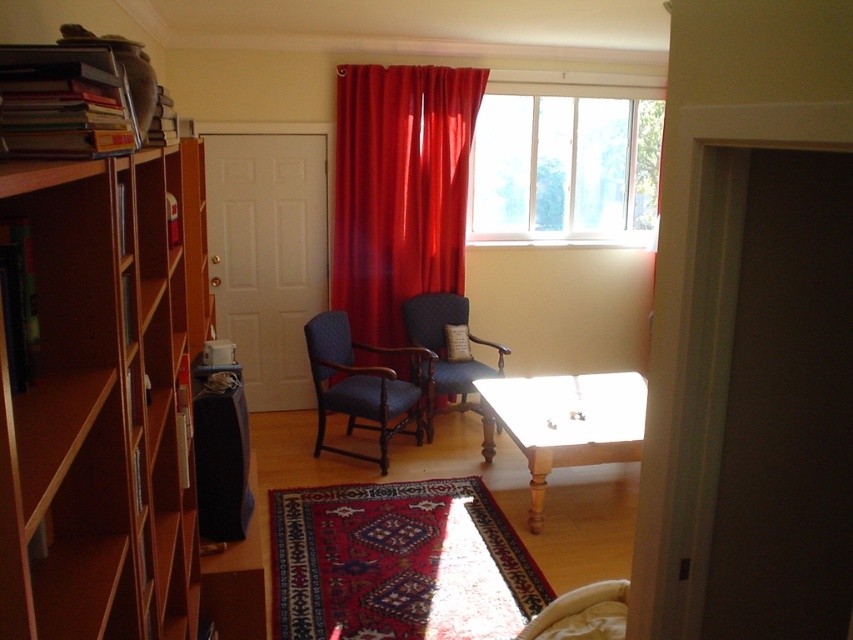
Which is more to the right, light wood table at center or dark blue quilted armchair at center?

Positioned to the right is light wood table at center.

Who is more distant from viewer, (x=634, y=448) or (x=457, y=317)?

The point (x=457, y=317) is behind.

Does point (543, 412) lie behind point (434, 339)?

That is False.

Where is `light wood table at center`? The height and width of the screenshot is (640, 853). light wood table at center is located at coordinates (564, 422).

Between brown wooden bookcase at left and dark blue quilted armchair at center, which one appears on the right side from the viewer's perspective?

From the viewer's perspective, dark blue quilted armchair at center appears more on the right side.

Describe the element at coordinates (103, 401) in the screenshot. The image size is (853, 640). I see `brown wooden bookcase at left` at that location.

Find the location of a particular element. This screenshot has height=640, width=853. brown wooden bookcase at left is located at coordinates (103, 401).

Does brown wooden bookcase at left lie in front of transparent glass window at upper center?

Yes, it is.

Is brown wooden bookcase at left taller than transparent glass window at upper center?

Correct, brown wooden bookcase at left is much taller as transparent glass window at upper center.

Does point (51, 456) come farther from viewer compared to point (577, 179)?

That is False.

Find the location of `brown wooden bookcase at left`. brown wooden bookcase at left is located at coordinates (103, 401).